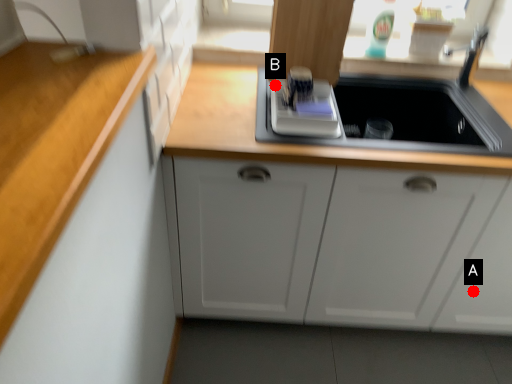
Question: Two points are circled on the image, labeled by A and B beside each circle. Which point is farther to the camera?

Choices:
 (A) A is further
 (B) B is further

Answer: (A)